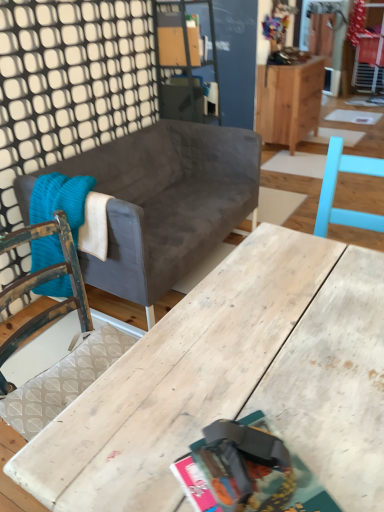
This screenshot has height=512, width=384. Find the location of `vacant point above knitted wool blanket at left (from a real-world perspective)`. vacant point above knitted wool blanket at left (from a real-world perspective) is located at coordinates (74, 183).